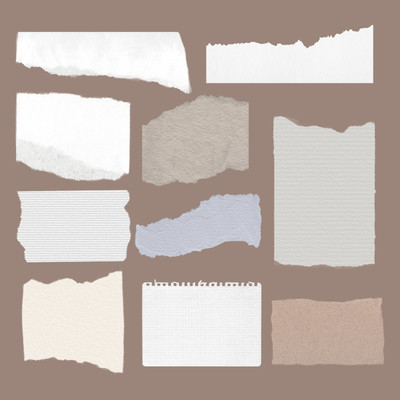
Where is `pieces of paper`? The width and height of the screenshot is (400, 400). pieces of paper is located at coordinates (244, 60), (120, 42), (56, 134), (211, 145), (300, 162), (222, 212), (72, 210), (78, 311), (190, 312), (294, 324).